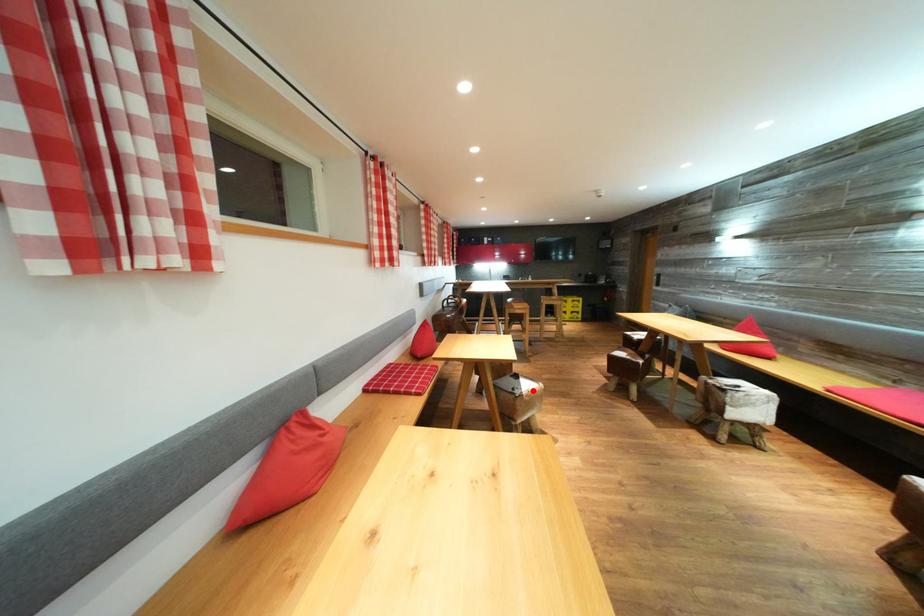
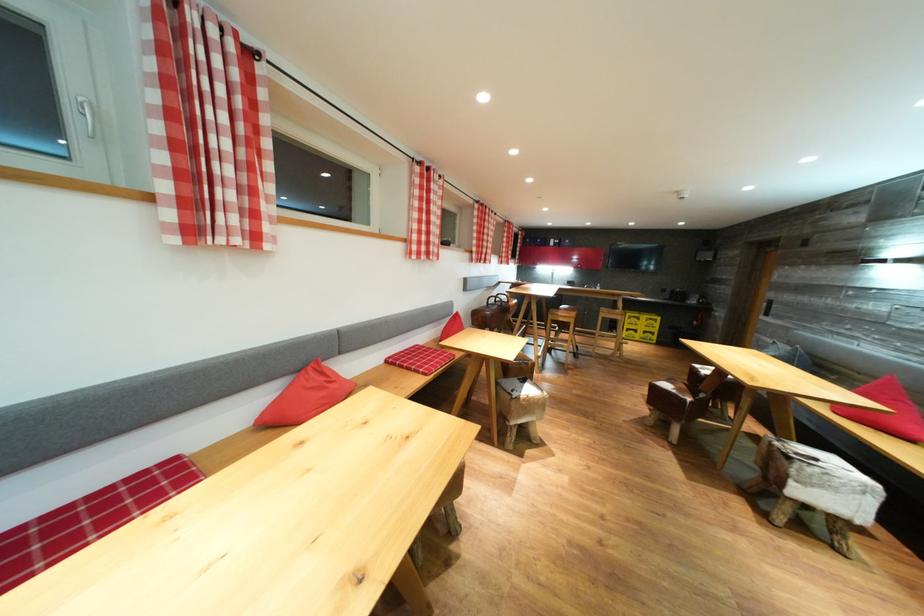
Question: I am providing you with two images of the same scene from different viewpoints. In image1, a red point is highlighted. Considering the same 3D point in image2, which of the following is correct?

Choices:
 (A) It is closer
 (B) It is farther

Answer: (B)